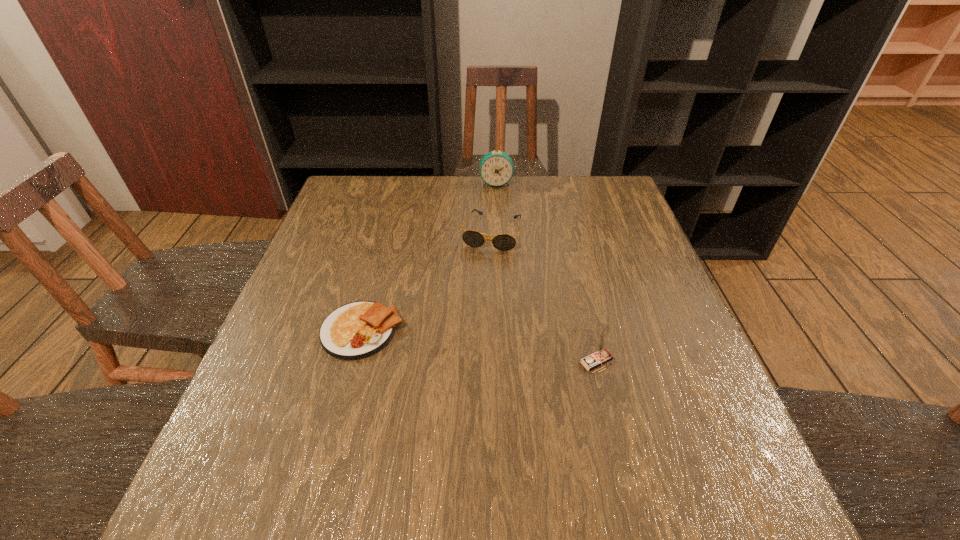
I want to click on the shortest object, so click(357, 330).

Find the location of a particular element. This screenshot has height=540, width=960. omelet is located at coordinates (357, 330).

Where is `matchbox`? matchbox is located at coordinates (602, 355).

Image resolution: width=960 pixels, height=540 pixels. In order to click on sunglasses in this screenshot , I will do `click(503, 242)`.

The image size is (960, 540). In order to click on the second shortest object in this screenshot , I will do `click(503, 242)`.

You are a GUI agent. You are given a task and a screenshot of the screen. Output one action in this format:
    pyautogui.click(x=<x>, y=<y>)
    Task: Click on the alarm clock
    Image resolution: width=960 pixels, height=540 pixels.
    Given the screenshot: What is the action you would take?
    [496, 168]

Where is `blank area located on the left of the leftmost object`? blank area located on the left of the leftmost object is located at coordinates pos(276,331).

Where is `free region located 0.300m on the left of the matchbox`? The image size is (960, 540). free region located 0.300m on the left of the matchbox is located at coordinates (435, 362).

Locate an element on the screen. The height and width of the screenshot is (540, 960). free region located 0.050m on the front-facing side of the sunglasses is located at coordinates (483, 264).

At what (x,y) coordinates should I click in order to perform the action: click on free space located 0.220m on the front-facing side of the sunglasses. Please return your answer as a coordinate pair (x, y). This screenshot has height=540, width=960. Looking at the image, I should click on (468, 310).